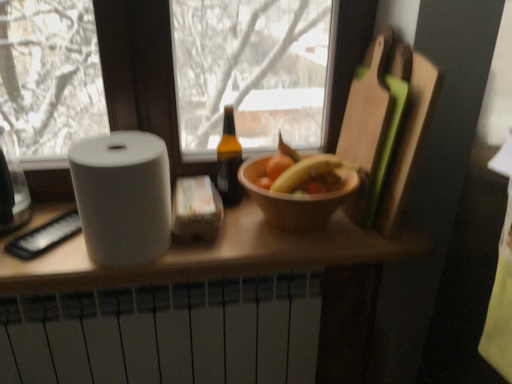
Question: Would you say brown glass bottle at center is to the left or to the right of wooden bowl at center in the picture?

Choices:
 (A) right
 (B) left

Answer: (B)

Question: From a real-world perspective, is brown glass bottle at center above or below wooden bowl at center?

Choices:
 (A) below
 (B) above

Answer: (B)

Question: Based on their relative distances, which object is farther from the smooth wooden bowl at center?

Choices:
 (A) wooden cutting board at right
 (B) wooden bowl at center
 (C) white matte radiator at lower center
 (D) white matte paper towel at left
 (E) brown glass bottle at center

Answer: (D)

Question: Which object is positioned farthest from the brown glass bottle at center?

Choices:
 (A) white matte paper towel at left
 (B) smooth wooden bowl at center
 (C) wooden cutting board at right
 (D) white matte radiator at lower center
 (E) clear glass jar at left

Answer: (E)